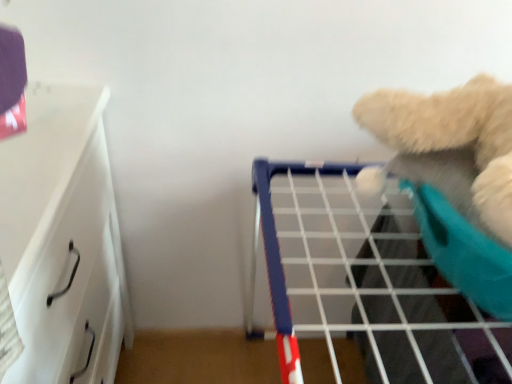
Question: Is white wire shelf at upper right far away from white glossy drawer at left?

Choices:
 (A) no
 (B) yes

Answer: (A)

Question: Considering the relative sizes of white wire shelf at upper right and white glossy drawer at left in the image provided, is white wire shelf at upper right thinner than white glossy drawer at left?

Choices:
 (A) no
 (B) yes

Answer: (A)

Question: Is white wire shelf at upper right not within white glossy drawer at left?

Choices:
 (A) no
 (B) yes

Answer: (B)

Question: Is white wire shelf at upper right further to the viewer compared to white glossy drawer at left?

Choices:
 (A) no
 (B) yes

Answer: (B)

Question: Could you tell me if white wire shelf at upper right is turned towards white glossy drawer at left?

Choices:
 (A) no
 (B) yes

Answer: (A)

Question: Considering the positions of white glossy drawer at left and white wire shelf at upper right in the image, is white glossy drawer at left wider or thinner than white wire shelf at upper right?

Choices:
 (A) wide
 (B) thin

Answer: (B)

Question: Which is correct: white glossy drawer at left is inside white wire shelf at upper right, or outside of it?

Choices:
 (A) outside
 (B) inside

Answer: (A)

Question: Is point (105, 309) closer or farther from the camera than point (344, 292)?

Choices:
 (A) farther
 (B) closer

Answer: (B)

Question: Would you say white glossy drawer at left is to the left or to the right of white wire shelf at upper right in the picture?

Choices:
 (A) right
 (B) left

Answer: (B)

Question: From the image's perspective, is white glossy drawer at left above or below fluffy white teddy bear at upper right?

Choices:
 (A) above
 (B) below

Answer: (B)

Question: Is white glossy drawer at left inside the boundaries of fluffy white teddy bear at upper right, or outside?

Choices:
 (A) inside
 (B) outside

Answer: (B)

Question: In the image, is white glossy drawer at left on the left side or the right side of fluffy white teddy bear at upper right?

Choices:
 (A) right
 (B) left

Answer: (B)

Question: From a real-world perspective, relative to fluffy white teddy bear at upper right, is white glossy drawer at left vertically above or below?

Choices:
 (A) above
 (B) below

Answer: (B)

Question: From the image's perspective, is white wire shelf at upper right located above or below white glossy drawer at left?

Choices:
 (A) below
 (B) above

Answer: (A)

Question: From a real-world perspective, is white wire shelf at upper right positioned above or below white glossy drawer at left?

Choices:
 (A) above
 (B) below

Answer: (B)